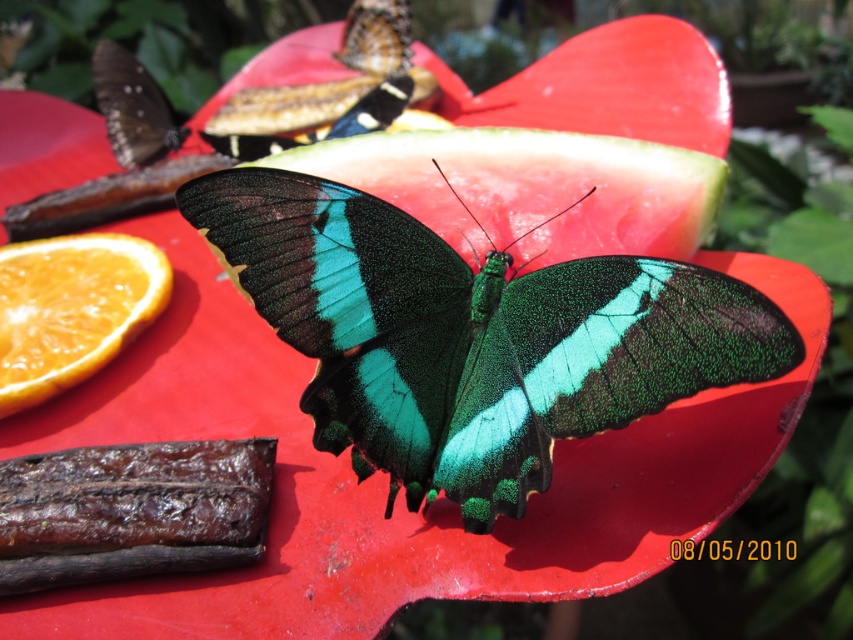
Does orangejuicy/citrusyfruit at lower left appear over matte brown butterfly at upper left?

No.

Can you confirm if orangejuicy/citrusyfruit at lower left is wider than matte brown butterfly at upper left?

Indeed, orangejuicy/citrusyfruit at lower left has a greater width compared to matte brown butterfly at upper left.

Which is in front, point (86, 339) or point (109, 99)?

Point (86, 339) is more forward.

Locate an element on the screen. Image resolution: width=853 pixels, height=640 pixels. orangejuicy/citrusyfruit at lower left is located at coordinates (71, 308).

Does emerald-green iridescent butterfly at center have a smaller size compared to matte brown butterfly at upper left?

Incorrect, emerald-green iridescent butterfly at center is not smaller in size than matte brown butterfly at upper left.

Does point (397, 260) lie in front of point (131, 88)?

Yes, it is.

What are the coordinates of `emerald-green iridescent butterfly at center` in the screenshot? It's located at (471, 337).

Can you confirm if emerald-green iridescent butterfly at center is taller than orangejuicy/citrusyfruit at lower left?

Yes.

Between emerald-green iridescent butterfly at center and orangejuicy/citrusyfruit at lower left, which one appears on the left side from the viewer's perspective?

orangejuicy/citrusyfruit at lower left is more to the left.

At what (x,y) coordinates should I click in order to perform the action: click on emerald-green iridescent butterfly at center. Please return your answer as a coordinate pair (x, y). The height and width of the screenshot is (640, 853). Looking at the image, I should click on pos(471,337).